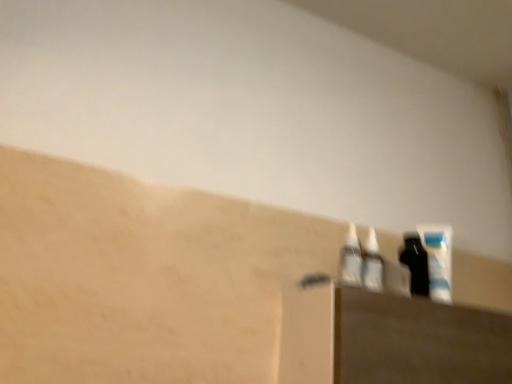
This screenshot has width=512, height=384. Describe the element at coordinates (438, 259) in the screenshot. I see `black plastic mouthwash at right` at that location.

This screenshot has width=512, height=384. Find the location of `black plastic mouthwash at right`. black plastic mouthwash at right is located at coordinates (438, 259).

I want to click on black plastic mouthwash at right, so click(438, 259).